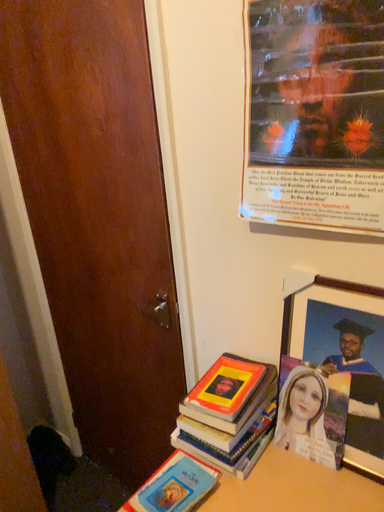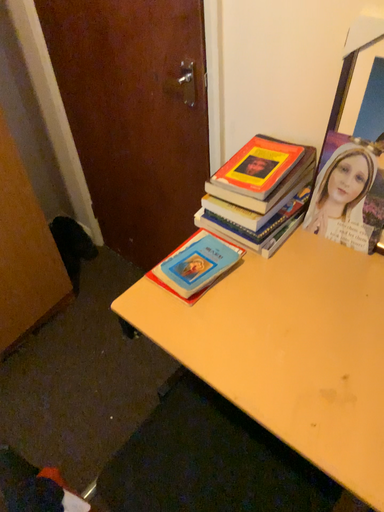
Question: How did the camera likely rotate when shooting the video?

Choices:
 (A) rotated upward
 (B) rotated downward

Answer: (B)